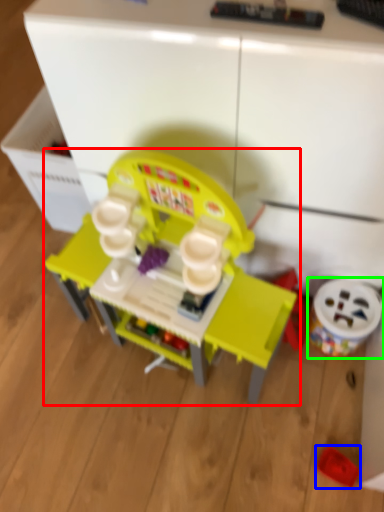
Question: Which object is the closest to the toy (highlighted by a red box)? Choose among these: toy (highlighted by a blue box) or toy (highlighted by a green box).

Choices:
 (A) toy
 (B) toy

Answer: (B)